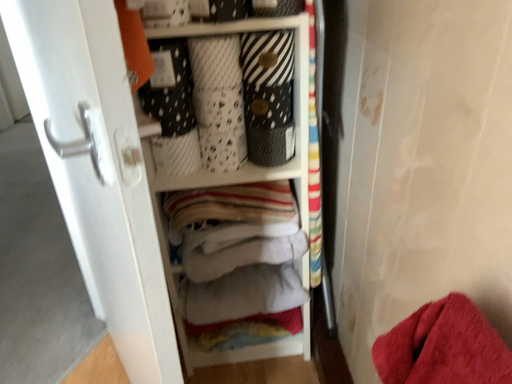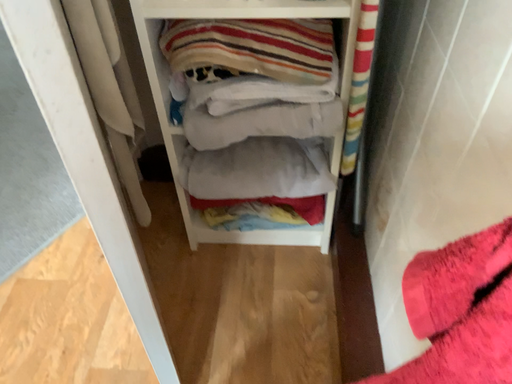
Question: Which way did the camera rotate in the video?

Choices:
 (A) rotated left
 (B) rotated right

Answer: (A)